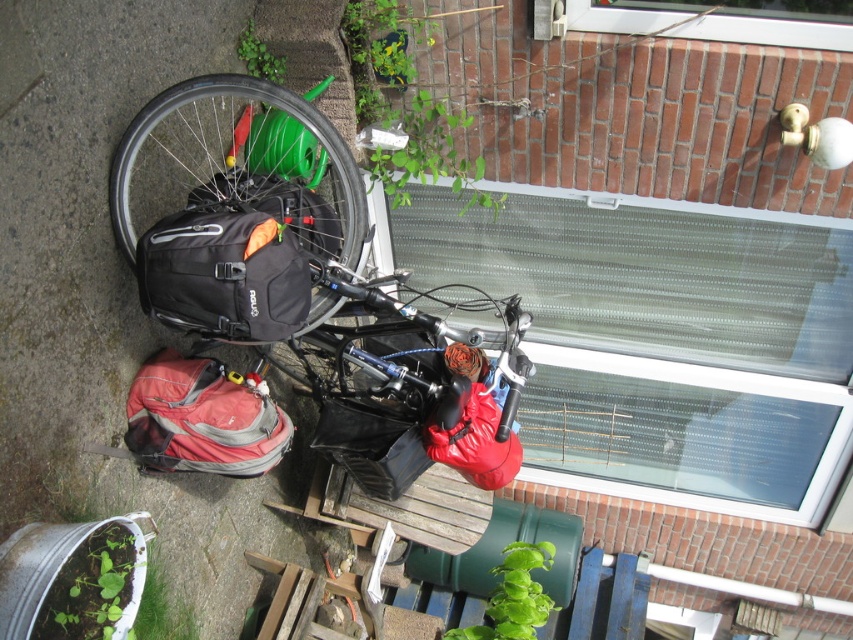
Question: Is matte black bicycle at center bigger than matte pink backpack at lower left?

Choices:
 (A) no
 (B) yes

Answer: (B)

Question: Can you confirm if black rubber tire at upper left is positioned to the left of matte pink backpack at lower left?

Choices:
 (A) yes
 (B) no

Answer: (B)

Question: Estimate the real-world distances between objects in this image. Which object is farther from the matte red bag at center?

Choices:
 (A) matte pink backpack at lower left
 (B) black rubber tire at upper left

Answer: (B)

Question: Which object is positioned farthest from the matte black backpack at center?

Choices:
 (A) black rubber tire at upper left
 (B) matte red bag at center

Answer: (B)

Question: Is matte black backpack at center bigger than matte pink backpack at lower left?

Choices:
 (A) no
 (B) yes

Answer: (A)

Question: Which point appears farthest from the camera in this image?

Choices:
 (A) (140, 285)
 (B) (109, 172)
 (C) (126, 225)
 (D) (178, 408)

Answer: (D)